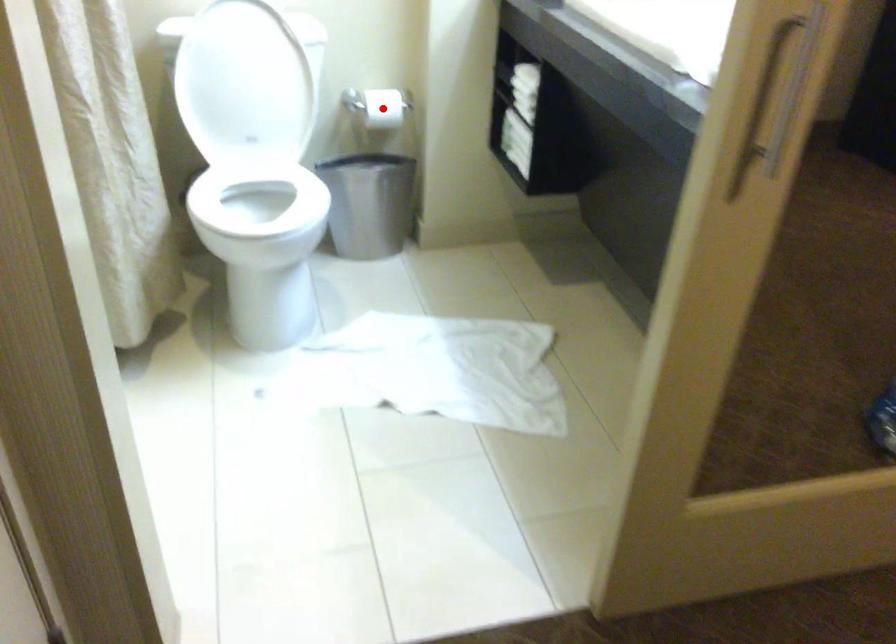
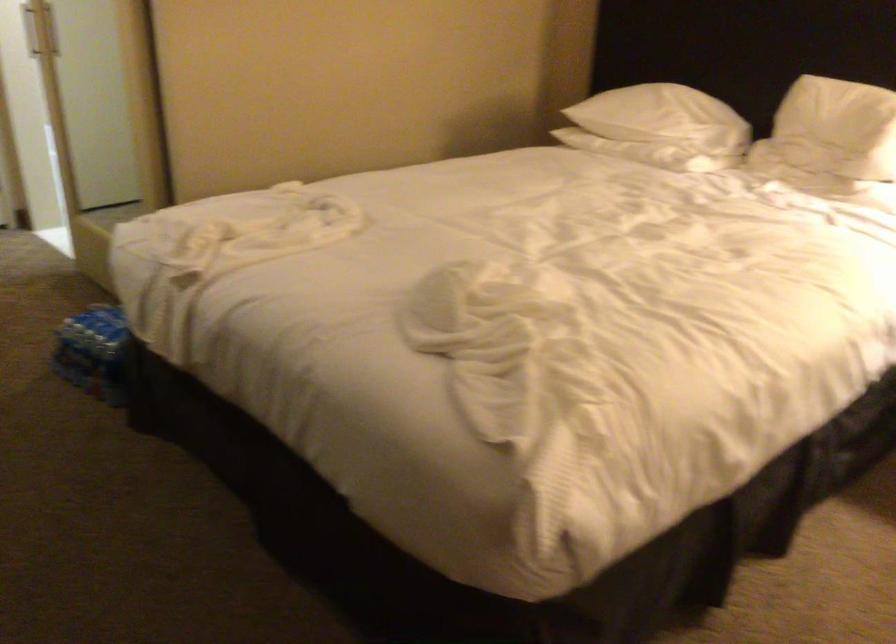
Question: I am providing you with two images of the same scene from different viewpoints. A red point is marked on the first image. Can you still see the location of the red point in image 2?

Choices:
 (A) Yes
 (B) No

Answer: (B)